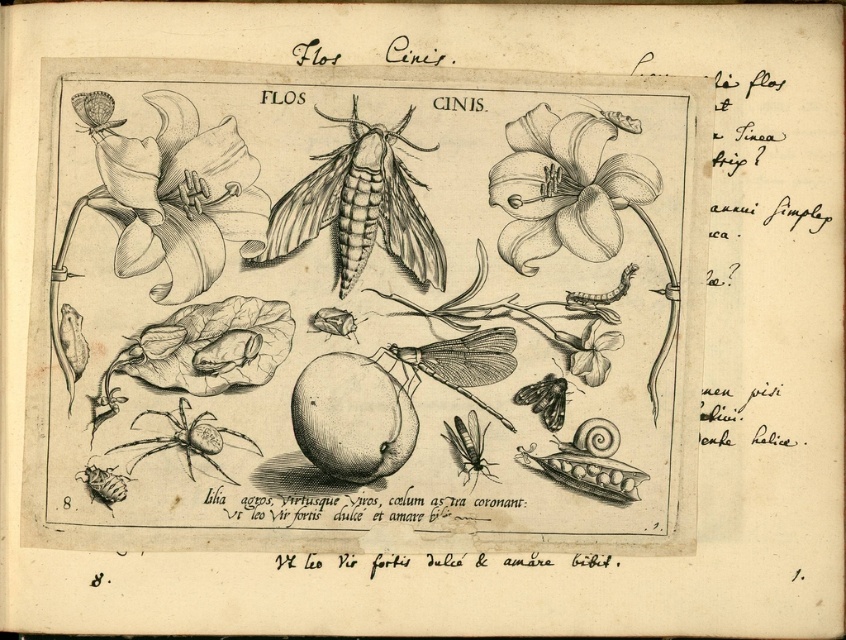
Which is in front, point (183, 445) or point (482, 436)?

Point (183, 445)

Can you confirm if brown fuzzy spider at lower left is positioned below translucent yellowish-green moth at center-right?

Incorrect, brown fuzzy spider at lower left is not positioned below translucent yellowish-green moth at center-right.

Who is more distant from viewer, (187,468) or (463,426)?

The point (463,426) is behind.

Where is `brown fuzzy spider at lower left`? This screenshot has width=846, height=640. brown fuzzy spider at lower left is located at coordinates (187, 436).

Is point (155, 150) closer to camera compared to point (432, 342)?

Yes.

Does point (166, 198) come behind point (460, 372)?

No, (166, 198) is in front of (460, 372).

Find the location of a particular element. The height and width of the screenshot is (640, 846). matte black lily at upper left is located at coordinates (174, 193).

Is smooth white lily at upper right smaller than smooth white flower at lower right?

Incorrect, smooth white lily at upper right is not smaller in size than smooth white flower at lower right.

Is smooth white lily at upper right above smooth white flower at lower right?

Correct, smooth white lily at upper right is located above smooth white flower at lower right.

The width and height of the screenshot is (846, 640). Find the location of `smooth white lily at upper right`. smooth white lily at upper right is located at coordinates (566, 186).